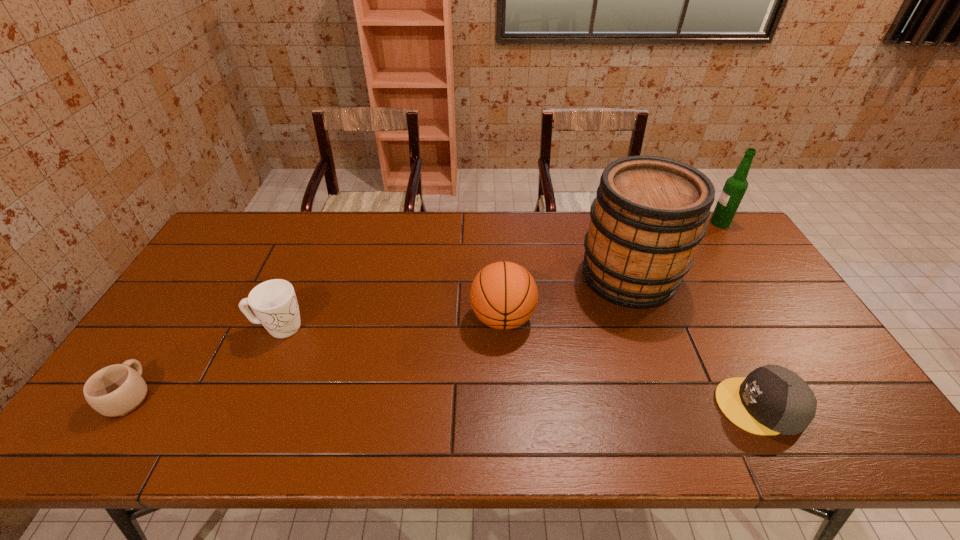
Image resolution: width=960 pixels, height=540 pixels. I want to click on object that is at the far right corner, so click(735, 186).

You are a GUI agent. You are given a task and a screenshot of the screen. Output one action in this format:
    pyautogui.click(x=<x>, y=<y>)
    Task: Click on the object located at the near right corner
    This screenshot has width=960, height=540.
    Given the screenshot: What is the action you would take?
    pyautogui.click(x=771, y=400)

This screenshot has height=540, width=960. Identify the location of vacant space at the far edge of the desktop. (579, 230).

Locate an element on the screen. The height and width of the screenshot is (540, 960). vacant space at the near edge of the desktop is located at coordinates (327, 415).

Identify the location of free space at the left edge. (218, 259).

In the image, there is a desktop. Identify the location of free region at the right edge. The height and width of the screenshot is (540, 960). (753, 262).

The height and width of the screenshot is (540, 960). I want to click on vacant space at the far left corner of the desktop, so click(232, 241).

Find the location of a particular element. Image resolution: width=960 pixels, height=540 pixels. free space between the shorter mug and the cider is located at coordinates (379, 335).

Where is `free space between the leftmost object and the cider`? The image size is (960, 540). free space between the leftmost object and the cider is located at coordinates (379, 335).

The height and width of the screenshot is (540, 960). What are the coordinates of `free space between the tallest object and the basketball` in the screenshot? It's located at (565, 297).